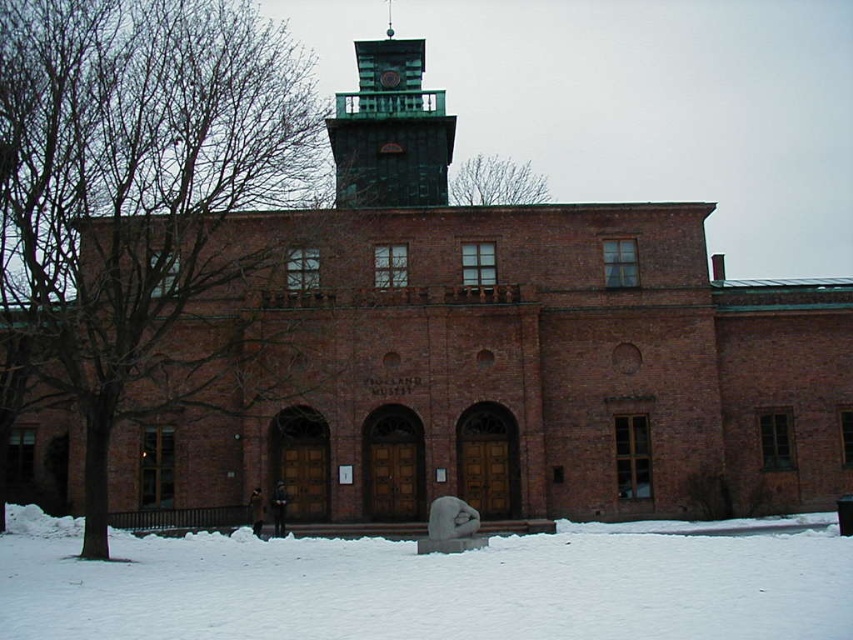
You are standing in front of the large brick building with the tower. There is a point marked at coordinates (424, 588). What is located at that point?

The point at coordinates (424, 588) corresponds to white powdery snow at lower center.

Consider the image. You are a drone operator who needs to fly your drone from the brown bark tree at left to the bare branches at upper center. What is the approximate distance you need to cover?

The distance between the brown bark tree at left and the bare branches at upper center is approximately 34.92 meters.